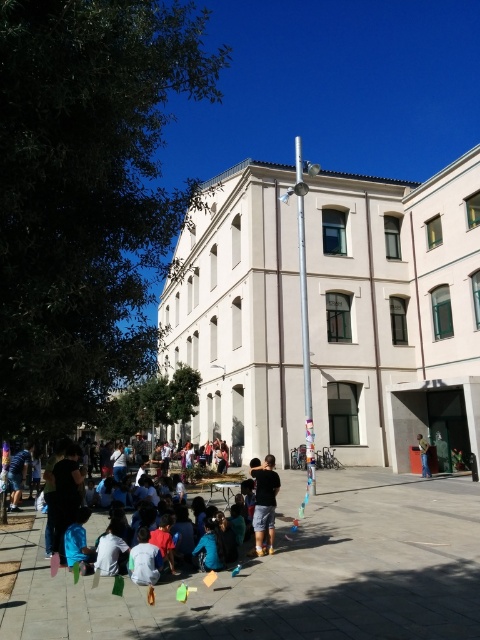
You are a photographer standing in front of the beige building and see the blue cotton shirt at lower left and the dark blue shorts at center. Which object is positioned higher from the ground?

The blue cotton shirt at lower left is above dark blue shorts at center, so the blue cotton shirt at lower left is higher from the ground.

You are standing at the point marked by the coordinates point [62,499]. Looking towards the beige building, which direction should you walk to avoid the shadow cast by the tall pole with a light fixture?

The blue cotton shirt at lower left is represented by point [62,499]. To avoid the shadow cast by the tall pole with a light fixture, you should walk towards the beige building, as the shadow is likely cast away from the building due to the pole being in the foreground. However, without specific shadow direction details, the safest path is directly toward the building.

What is the exact 2D coordinate of the blue cotton shirt at lower left in the image?

The exact 2D coordinate of the blue cotton shirt at lower left is at point (62, 499).